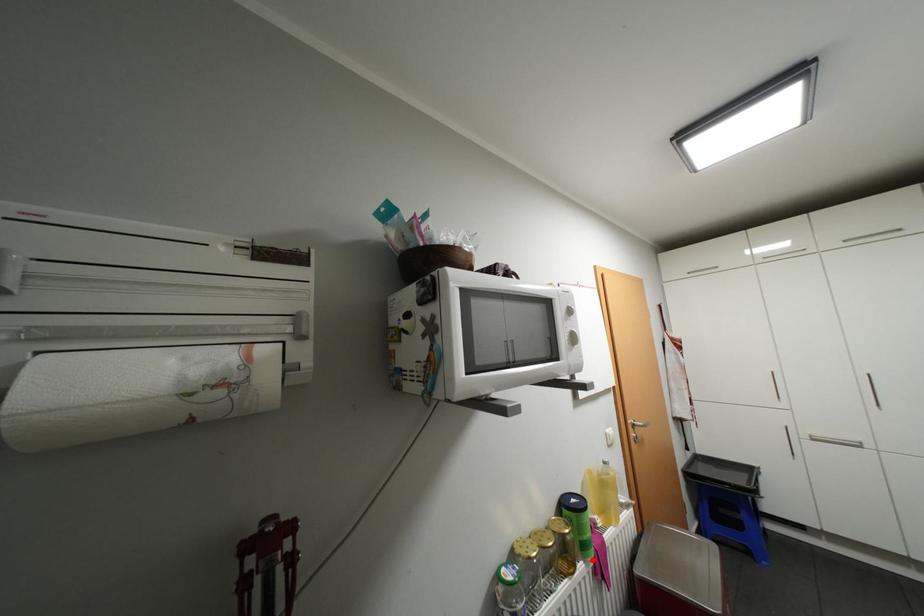
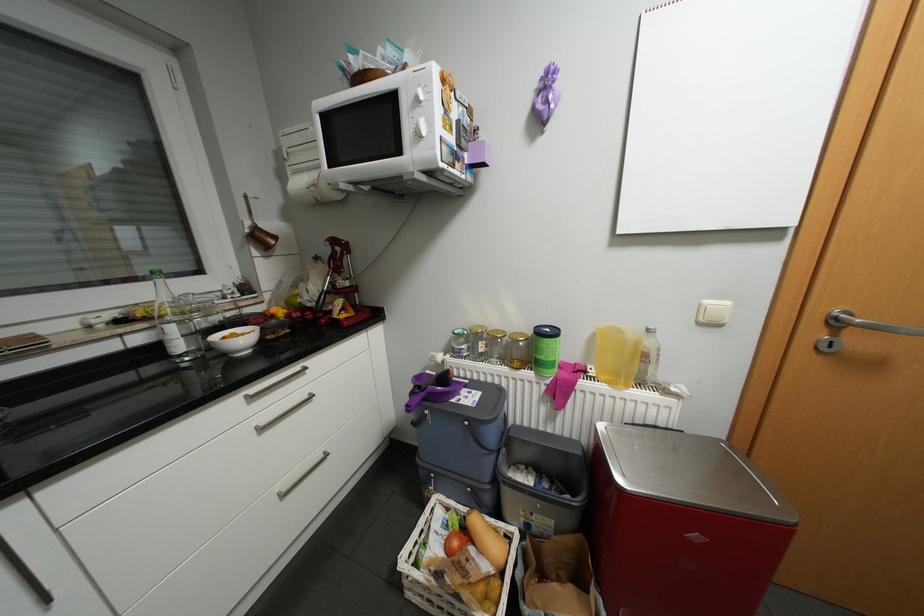
Locate, in the second image, the point that corresponds to the highlighted location in the first image.

(544, 373)